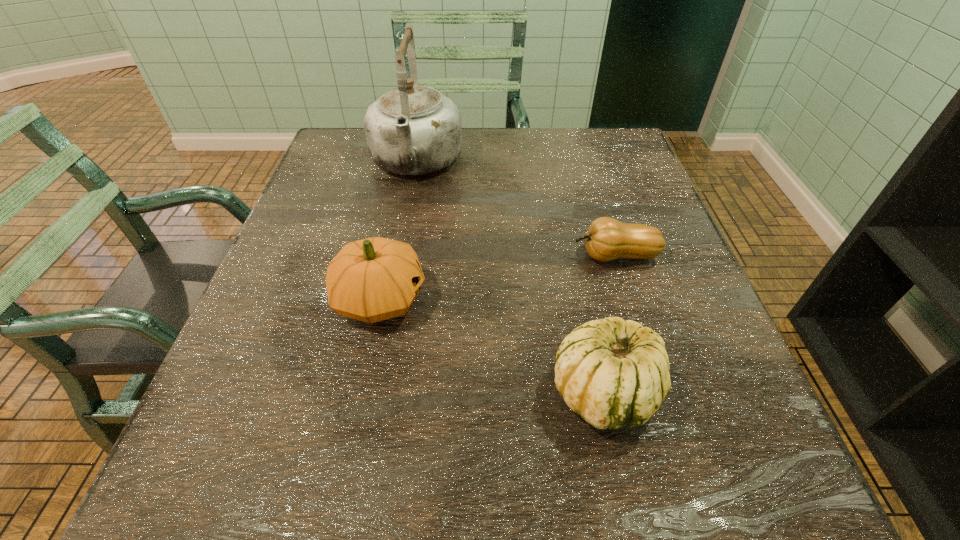
The image size is (960, 540). Find the location of `free space located 0.360m on the stem side of the shortest gourd`. free space located 0.360m on the stem side of the shortest gourd is located at coordinates (392, 255).

What are the coordinates of `object located in the far edge section of the desktop` in the screenshot? It's located at (411, 130).

Locate an element on the screen. The height and width of the screenshot is (540, 960). kettle situated at the left edge is located at coordinates (411, 130).

Identify the location of gourd that is at the left edge. This screenshot has height=540, width=960. (374, 279).

Identify the location of object that is at the far left corner. (411, 130).

This screenshot has width=960, height=540. I want to click on vacant space at the far edge of the desktop, so click(x=450, y=168).

In the image, there is a desktop. At what (x,y) coordinates should I click in order to perform the action: click on vacant space at the near edge. Please return your answer as a coordinate pair (x, y). Looking at the image, I should click on (562, 494).

I want to click on free space at the left edge of the desktop, so click(297, 310).

At what (x,y) coordinates should I click in order to perform the action: click on vacant space at the right edge. Please return your answer as a coordinate pair (x, y). Looking at the image, I should click on (604, 193).

This screenshot has height=540, width=960. Identify the location of free space at the far left corner. (370, 165).